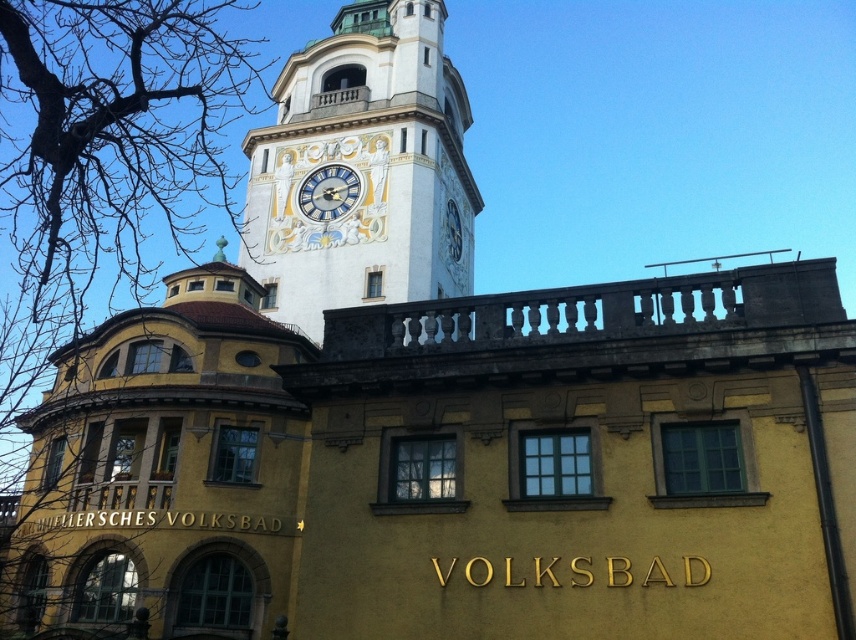
You are an architect analyzing the facade of the historic building. You notice the bare branches at upper left and the gold textured clock at center. Which object is located to the left of the other?

The bare branches at upper left is positioned on the left side of gold textured clock at center.

You are an architect analyzing the historic building. You notice the bare branches at upper left and the white painted stone clock tower at upper center in the scene. Which object occupies more visual space in the image?

The bare branches at upper left occupies more visual space compared to the white painted stone clock tower at upper center as it has a larger size.